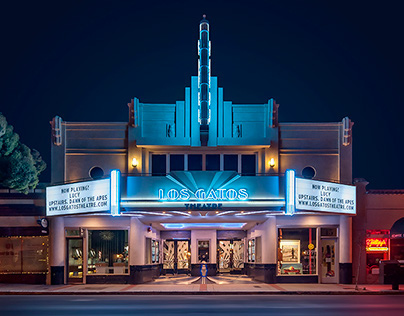
Locate an element on the screen. white lights is located at coordinates (293, 195), (113, 191).